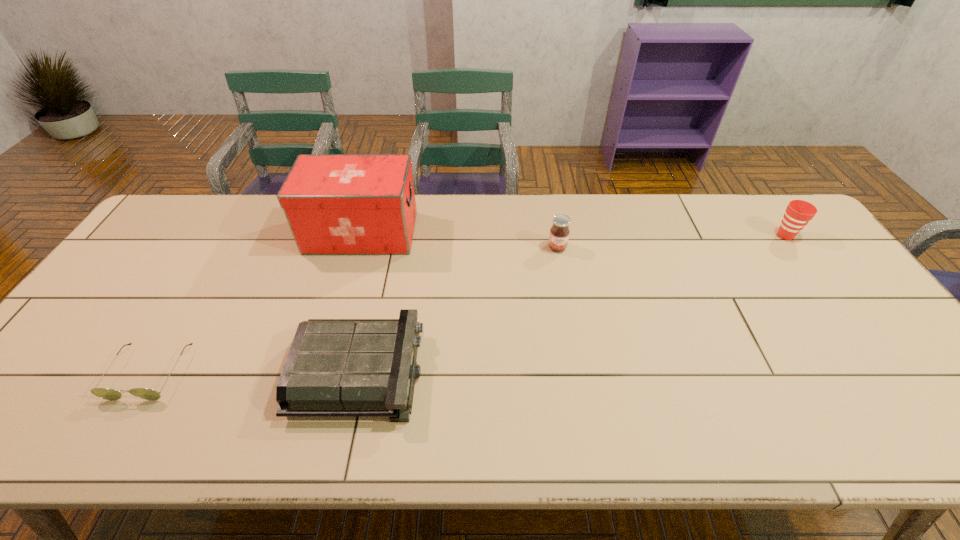
Image resolution: width=960 pixels, height=540 pixels. I want to click on free spot located on the front-facing side of the sunglasses, so click(x=118, y=426).

The image size is (960, 540). I want to click on the first-aid kit present at the far edge, so click(x=334, y=203).

The height and width of the screenshot is (540, 960). In order to click on cup at the far edge in this screenshot , I will do `click(798, 213)`.

The image size is (960, 540). Find the location of `object located in the near edge section of the desktop`. object located in the near edge section of the desktop is located at coordinates (335, 367).

Locate an element on the screen. object positioned at the right edge is located at coordinates (798, 213).

This screenshot has width=960, height=540. Find the location of `object located in the far right corner section of the desktop`. object located in the far right corner section of the desktop is located at coordinates (798, 213).

The image size is (960, 540). I want to click on free space at the far edge of the desktop, so click(672, 233).

Identify the location of free space at the near edge. (365, 427).

The image size is (960, 540). In order to click on vacant region at the left edge of the desktop in this screenshot , I will do `click(162, 249)`.

Identify the location of vacant space at the right edge of the desktop. Image resolution: width=960 pixels, height=540 pixels. pos(814,254).